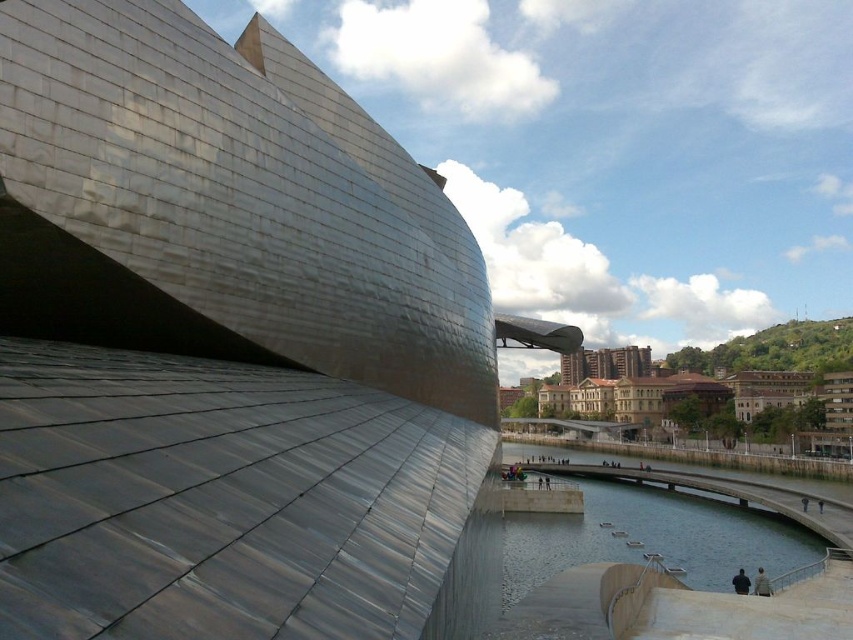
Can you confirm if clear water at lower center is wider than dark brown leather jacket at lower right?

Indeed, clear water at lower center has a greater width compared to dark brown leather jacket at lower right.

Does point (583, 531) lie in front of point (753, 588)?

No.

Locate an element on the screen. The width and height of the screenshot is (853, 640). clear water at lower center is located at coordinates (654, 534).

Does clear water at lower center have a smaller size compared to dark blue fabric jacket at lower right?

No.

At what (x,y) coordinates should I click in order to perform the action: click on clear water at lower center. Please return your answer as a coordinate pair (x, y). Image resolution: width=853 pixels, height=640 pixels. Looking at the image, I should click on (654, 534).

From the picture: Does metallic silver building at upper left come in front of clear water at lower center?

Yes, it is.

Who is positioned more to the left, metallic silver building at upper left or clear water at lower center?

Positioned to the left is metallic silver building at upper left.

Who is more distant from viewer, (134, 76) or (540, 579)?

The point (540, 579) is more distant.

Find the location of a particular element. metallic silver building at upper left is located at coordinates (223, 340).